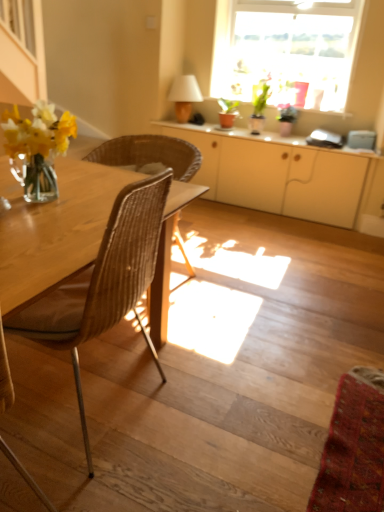
At what (x,y) coordinates should I click in order to perform the action: click on free space in front of green glossy plant at upper center. Please return your answer as a coordinate pair (x, y). Image resolution: width=384 pixels, height=512 pixels. Looking at the image, I should click on (274, 135).